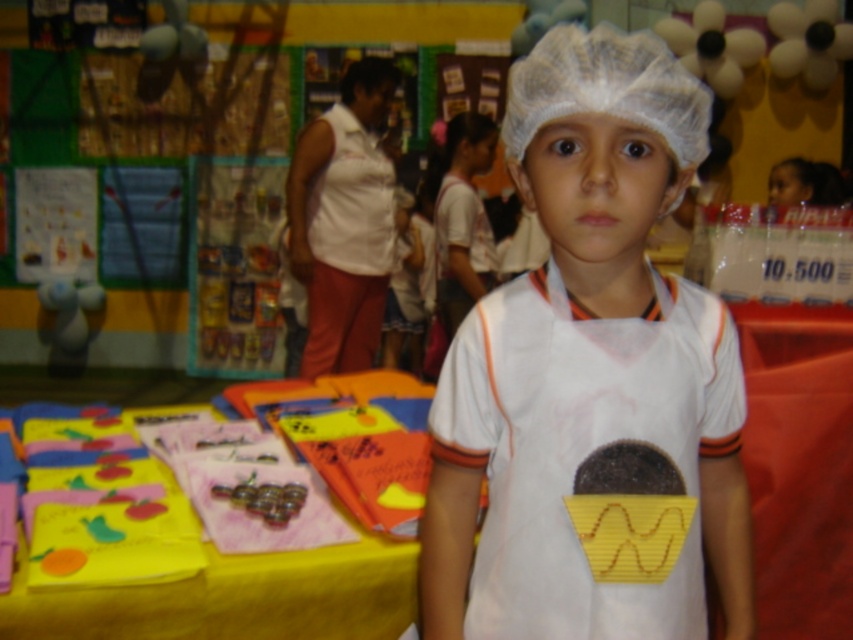
Question: Can you confirm if yellow fabric at lower left is bigger than white mesh hat at center?

Choices:
 (A) no
 (B) yes

Answer: (B)

Question: Which object appears closest to the camera in this image?

Choices:
 (A) white matte hairnet at center
 (B) white mesh hat at center
 (C) yellow fabric at lower left

Answer: (A)

Question: Is white matte hairnet at center below white mesh hat at center?

Choices:
 (A) yes
 (B) no

Answer: (A)

Question: Which of the following is the farthest from the observer?

Choices:
 (A) yellow fabric at lower left
 (B) white matte hairnet at center

Answer: (A)

Question: Among these objects, which one is farthest from the camera?

Choices:
 (A) white matte hairnet at center
 (B) white mesh hat at center

Answer: (B)

Question: Does white matte hairnet at center appear under white mesh hat at center?

Choices:
 (A) no
 (B) yes

Answer: (B)